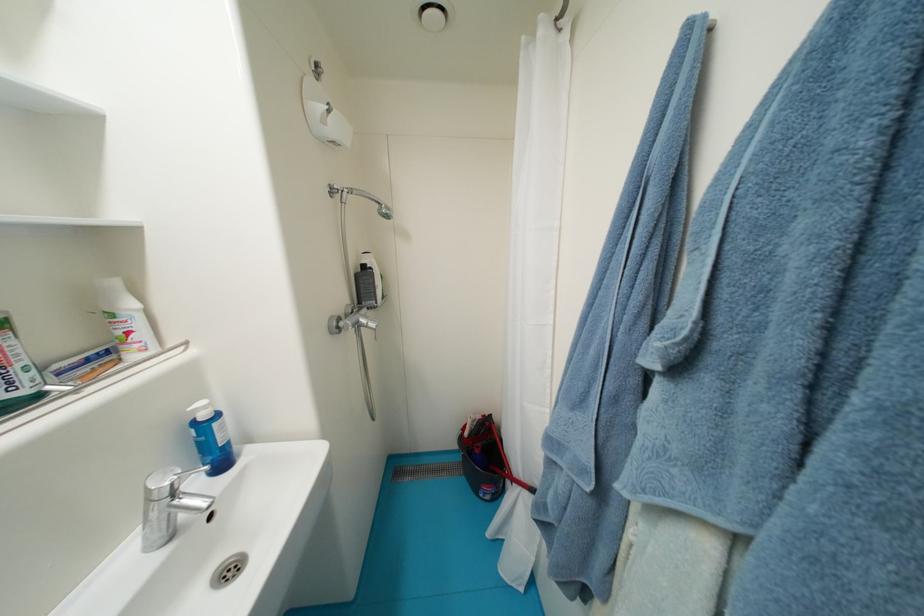
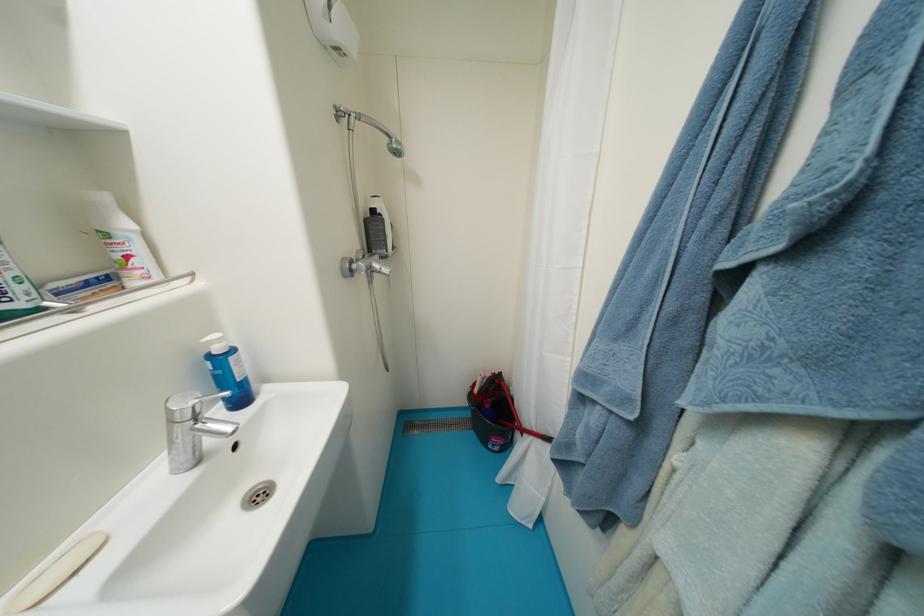
In the second image, find the point that corresponds to the point at 370,323 in the first image.

(383, 267)